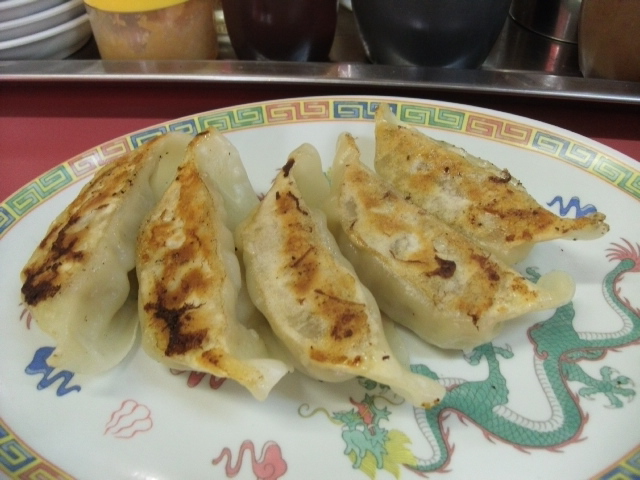
I want to click on plate, so click(x=573, y=453).